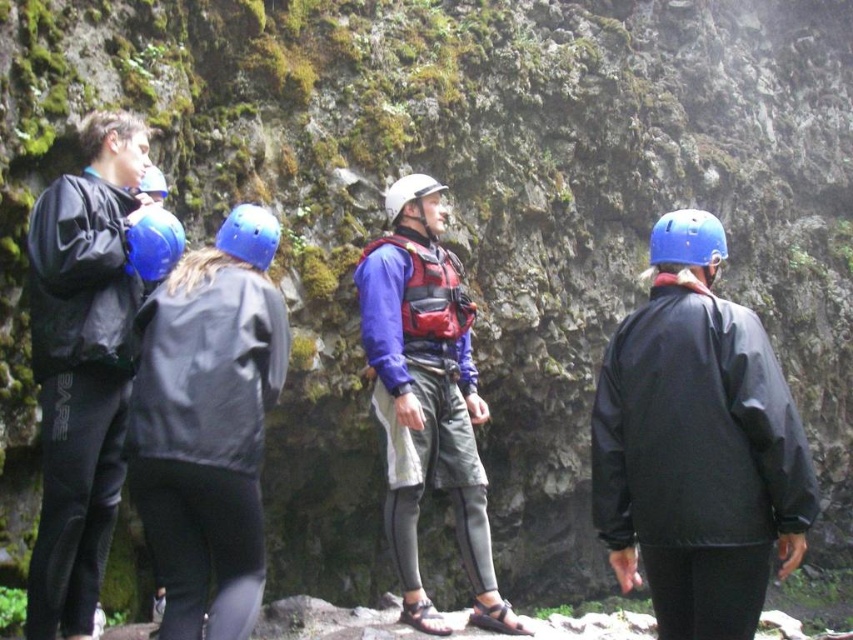
You are a safety inspector checking gear sizes for a group. You notice the matte black wetsuit at left and the matte blue helmet at center. Which item is larger in size?

The matte blue helmet at center is larger than the matte black wetsuit at left.

Consider the image. You are a safety inspector evaluating the setup for a climbing activity. You notice the matte black wetsuit at left and the matte blue helmet at center. Which object takes up more horizontal space in the image?

The matte blue helmet at center takes up more horizontal space than the matte black wetsuit at left because the matte black wetsuit at left has a lesser width compared to matte blue helmet at center.

You are a safety inspector checking the climbing site. You notice the matte black wetsuit at left and the matte blue helmet at center. According to safety protocols, which item should be checked first if visibility is a concern?

The matte blue helmet at center should be checked first because it is positioned behind the matte black wetsuit at left, making it potentially less visible to others.